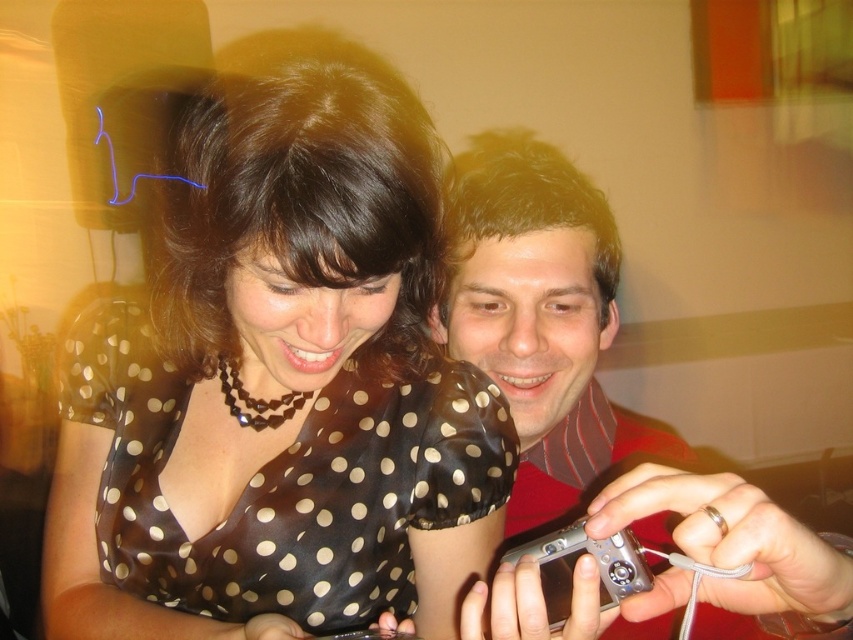
You are taking a photo of two people in the scene. The first person is at point (239, 348) and the second is at point (576, 465). Which person should you focus on to ensure they are in sharp focus if your camera can only focus on one point?

You should focus on point (239, 348) because it is closer to the camera than point (576, 465), so focusing there will keep that person in sharp focus while the other may be slightly blurred.